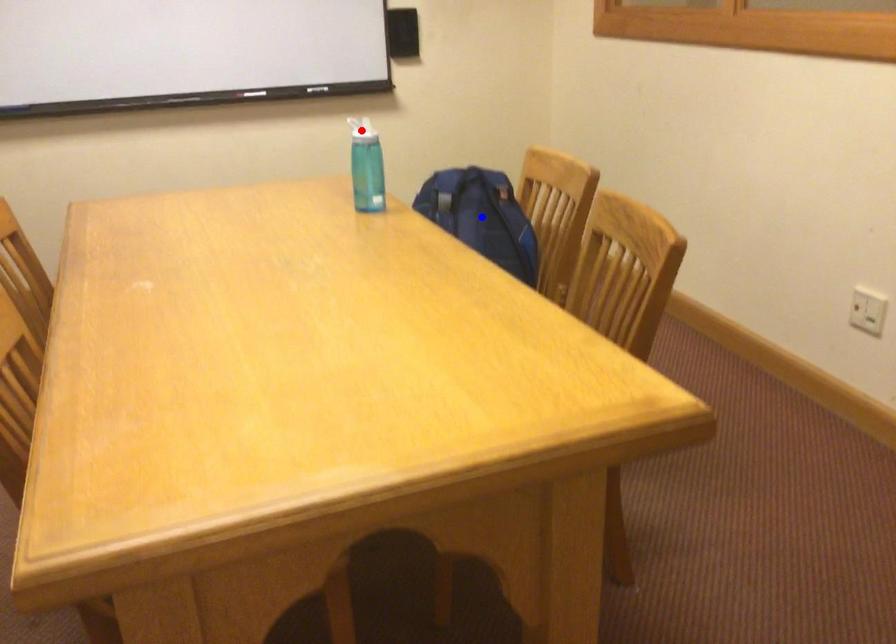
Question: In the image, two points are highlighted. Which point is nearer to the camera? Reply with the corresponding letter.

Choices:
 (A) blue point
 (B) red point

Answer: (B)